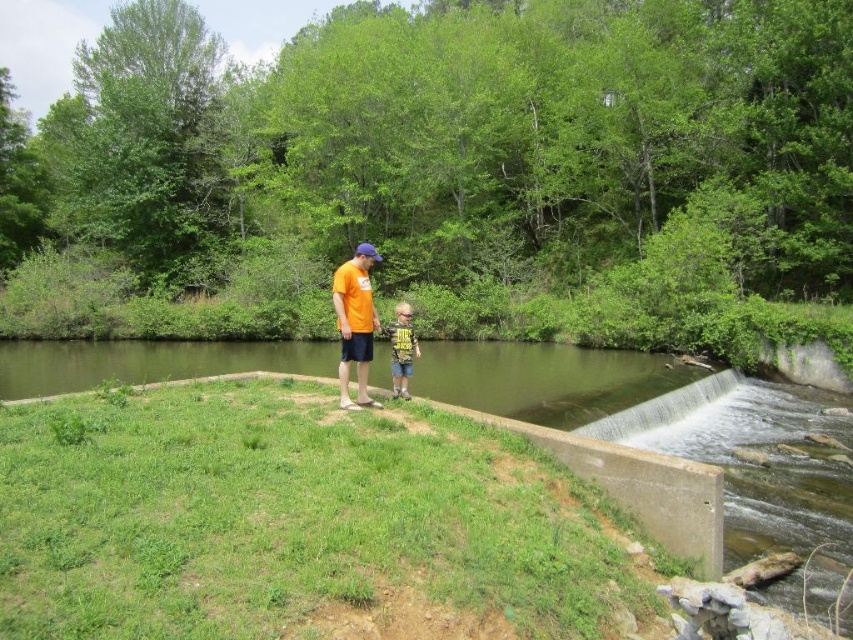
Question: Among these points, which one is farthest from the camera?

Choices:
 (A) (358, 246)
 (B) (413, 332)
 (C) (628, 388)

Answer: (A)

Question: Which point is closer to the camera?

Choices:
 (A) orange t-shirt at center
 (B) green concrete water at center

Answer: (B)

Question: Is green concrete water at center thinner than orange t-shirt at center?

Choices:
 (A) no
 (B) yes

Answer: (A)

Question: Where is orange t-shirt at center located in relation to matte green t-shirt at center in the image?

Choices:
 (A) left
 (B) right

Answer: (A)

Question: Which object is the closest to the green concrete water at center?

Choices:
 (A) matte green t-shirt at center
 (B) orange t-shirt at center

Answer: (A)

Question: Does orange t-shirt at center appear over matte green t-shirt at center?

Choices:
 (A) no
 (B) yes

Answer: (B)